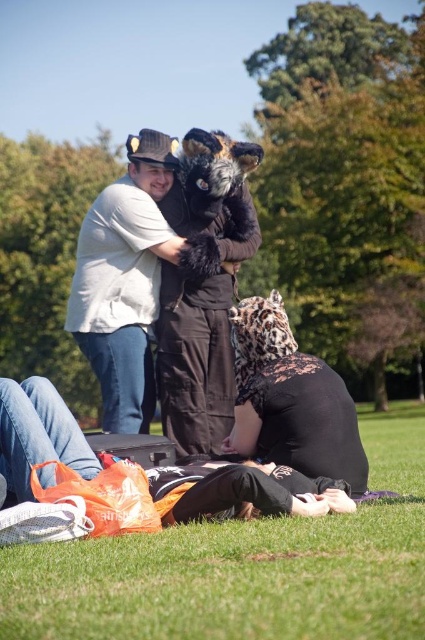
You are a photographer trying to capture a candid shot of the two people in the scene. You want to ensure both the white cotton shirt at center and the leopard print fabric at lower center are clearly visible in the frame. Given their positions, which one would you focus on first to ensure both are in focus?

The white cotton shirt at center is much taller than the leopard print fabric at lower center, so focusing on the white cotton shirt at center first would help ensure both are in focus since it is further away and requires a deeper depth of field.

You are a photographer standing at the center of the park. You want to take a photo of the white cotton shirt at center and leopard print fabric at lower center together in the frame. The camera you are using has a maximum focus range of 5 feet. Will both subjects be in focus?

The distance between the white cotton shirt at center and leopard print fabric at lower center is 5.22 feet, which exceeds the camera maximum focus range of 5 feet. Therefore, both subjects cannot be in focus simultaneously.

You are standing in the park scene and want to walk from the point at coordinates point (393, 632) to the point at coordinates point (115, 344). Which direction should you move to get closer to your destination?

To move from point (393, 632) to point (115, 344), you should move downward and to the left since point (115, 344) is further away from the viewer compared to point (393, 632).